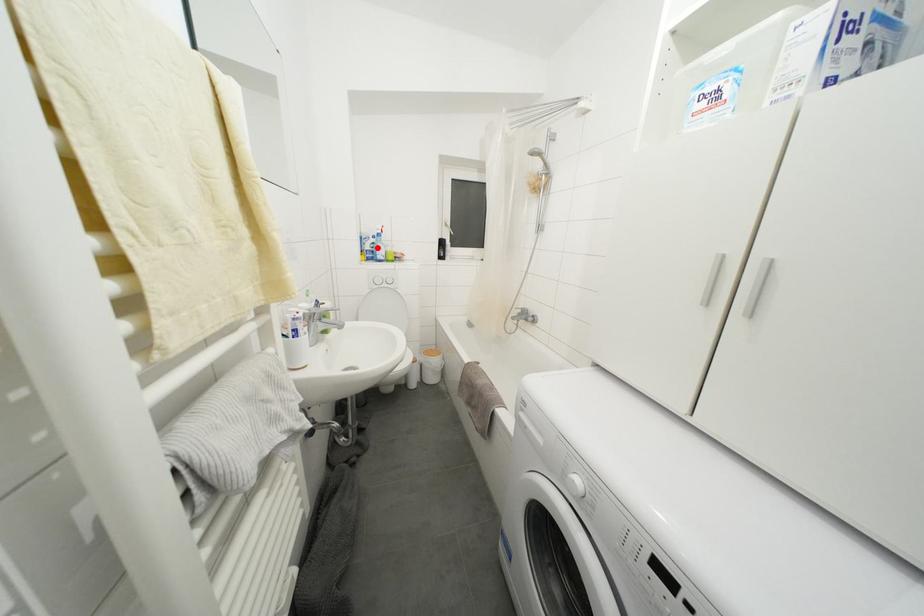
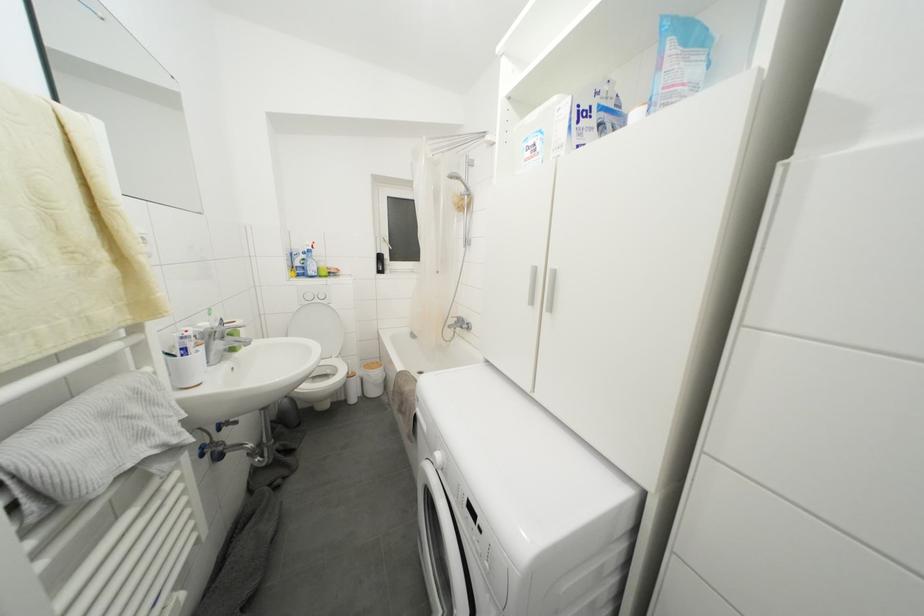
The point at the highlighted location is marked in the first image. Where is the corresponding point in the second image?

(308, 264)